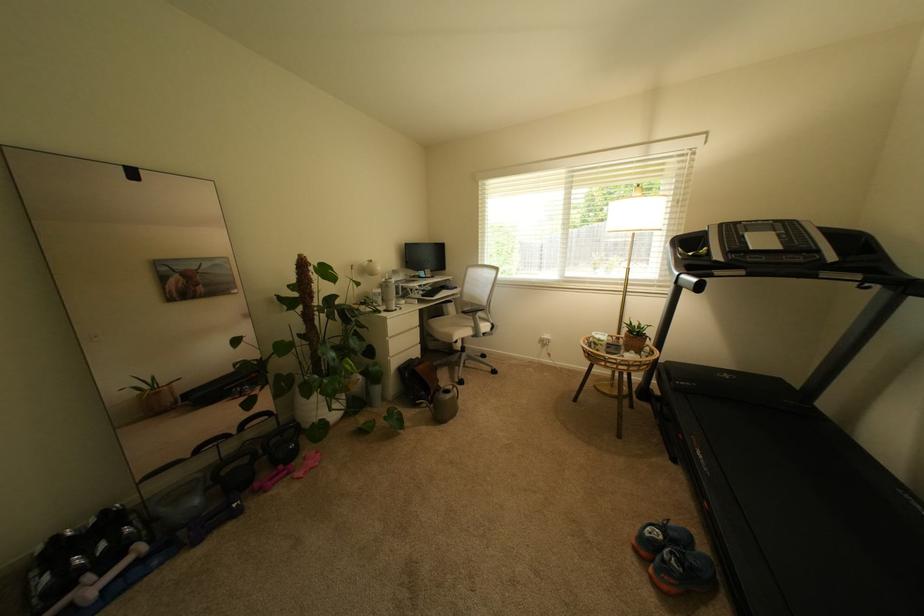
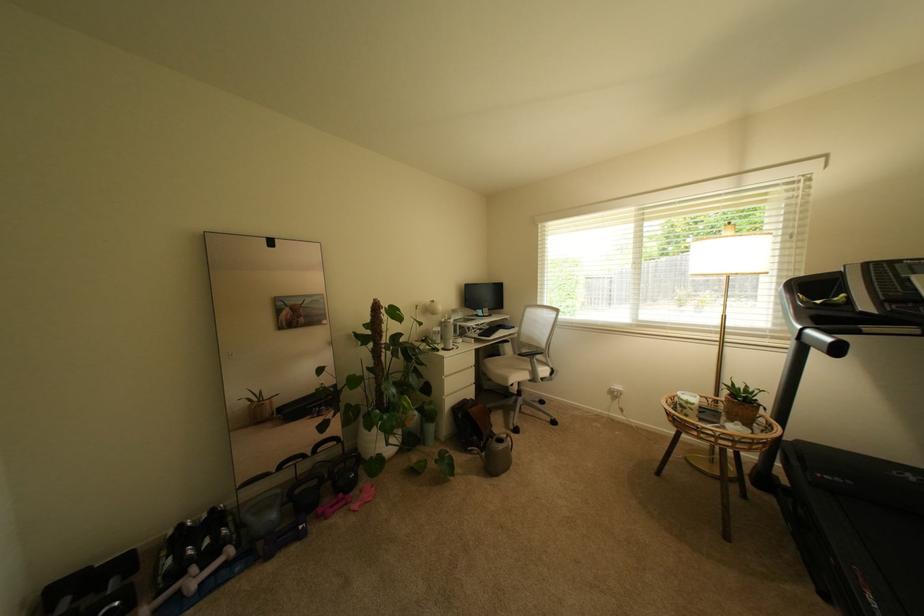
Question: I am providing you with two images of the same scene from different viewpoints. Which of the following objects are not visible in image2?

Choices:
 (A) gray kettlebell
 (B) white chair armrest
 (C) white water bottle
 (D) none of these

Answer: (D)